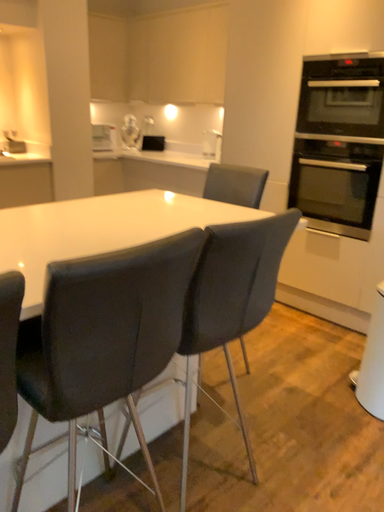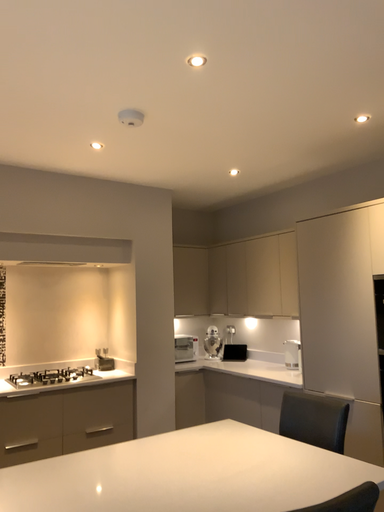
Question: How did the camera likely rotate when shooting the video?

Choices:
 (A) rotated right
 (B) rotated left

Answer: (B)